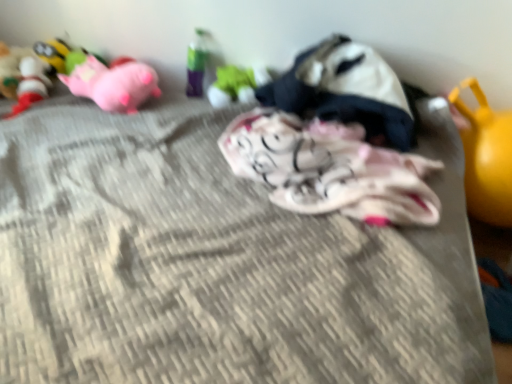
In order to face translucent plastic bottle at upper center, which is the fourth toy from left to right, should I rotate leftwards or rightwards?

Rotate left and turn 7.596 degrees.

The image size is (512, 384). What do you see at coordinates (217, 262) in the screenshot?
I see `textured fabric mattress at center` at bounding box center [217, 262].

Where is `yellow rubber ball at right, marked as the 8th toy in a left-to-right arrangement`? yellow rubber ball at right, marked as the 8th toy in a left-to-right arrangement is located at coordinates (486, 158).

Describe the element at coordinates (236, 85) in the screenshot. The image size is (512, 384). I see `green matte toy at center, positioned as the fourth toy in right-to-left order` at that location.

Describe the element at coordinates (330, 169) in the screenshot. The height and width of the screenshot is (384, 512). I see `fluffy white blanket at center, which is the 6th toy in left-to-right order` at that location.

What are the coordinates of `pink plush pig at upper left, the sixth toy when ordered from right to left` in the screenshot? It's located at (113, 83).

Image resolution: width=512 pixels, height=384 pixels. Describe the element at coordinates (346, 90) in the screenshot. I see `white cotton blanket at center, the second toy from the right` at that location.

Image resolution: width=512 pixels, height=384 pixels. Identify the location of white cotton blanket at center, the second toy from the right. (346, 90).

Where is `translucent plastic bottle at upper center, which is the fourth toy from left to right`? The height and width of the screenshot is (384, 512). translucent plastic bottle at upper center, which is the fourth toy from left to right is located at coordinates (200, 61).

From a real-world perspective, who is located lower, fluffy white blanket at center, which is the 6th toy in left-to-right order, or white cotton blanket at center, the second toy from the right?

fluffy white blanket at center, which is the 6th toy in left-to-right order.

Can you tell me how much fluffy white blanket at center, placed as the third toy when sorted from right to left, and white cotton blanket at center, which is counted as the seventh toy, starting from the left, differ in facing direction?

2.15e-05 degrees separate the facing orientations of fluffy white blanket at center, placed as the third toy when sorted from right to left, and white cotton blanket at center, which is counted as the seventh toy, starting from the left.

Between fluffy white blanket at center, placed as the third toy when sorted from right to left, and white cotton blanket at center, which is counted as the seventh toy, starting from the left, which one has smaller size?

white cotton blanket at center, which is counted as the seventh toy, starting from the left, is smaller.

Find the location of a particular element. toy that is the 1st object located above the fluffy white blanket at center, which is the 6th toy in left-to-right order (from the image's perspective) is located at coordinates (346, 90).

Is the surface of white cotton blanket at center, which is counted as the seventh toy, starting from the left, in direct contact with yellow rubber ball at right, the 1th toy viewed from the right?

white cotton blanket at center, which is counted as the seventh toy, starting from the left, and yellow rubber ball at right, the 1th toy viewed from the right, are not in contact.

Which of these two, white cotton blanket at center, the second toy from the right, or yellow rubber ball at right, the 1th toy viewed from the right, stands shorter?

white cotton blanket at center, the second toy from the right, is shorter.

Could you measure the distance between white cotton blanket at center, which is counted as the seventh toy, starting from the left, and yellow rubber ball at right, the 1th toy viewed from the right?

white cotton blanket at center, which is counted as the seventh toy, starting from the left, is 13.20 inches from yellow rubber ball at right, the 1th toy viewed from the right.

Which object is positioned more to the left, white cotton blanket at center, the second toy from the right, or yellow rubber ball at right, marked as the 8th toy in a left-to-right arrangement?

From the viewer's perspective, white cotton blanket at center, the second toy from the right, appears more on the left side.

Does green matte toy at center, acting as the fifth toy starting from the left, touch white cotton blanket at center, the second toy from the right?

They are not placed beside each other.

Can you confirm if green matte toy at center, positioned as the fourth toy in right-to-left order, is smaller than white cotton blanket at center, which is counted as the seventh toy, starting from the left?

Correct, green matte toy at center, positioned as the fourth toy in right-to-left order, occupies less space than white cotton blanket at center, which is counted as the seventh toy, starting from the left.

Does green matte toy at center, acting as the fifth toy starting from the left, turn towards white cotton blanket at center, which is counted as the seventh toy, starting from the left?

No.

Which of these two, green matte toy at center, positioned as the fourth toy in right-to-left order, or white cotton blanket at center, which is counted as the seventh toy, starting from the left, is thinner?

With smaller width is green matte toy at center, positioned as the fourth toy in right-to-left order.

Can you confirm if yellow rubber ball at right, the 1th toy viewed from the right, is wider than textured fabric mattress at center?

No, yellow rubber ball at right, the 1th toy viewed from the right, is not wider than textured fabric mattress at center.

Between yellow rubber ball at right, marked as the 8th toy in a left-to-right arrangement, and textured fabric mattress at center, which one has more height?

textured fabric mattress at center is taller.

Based on the photo, from a real-world perspective, who is located higher, yellow rubber ball at right, the 1th toy viewed from the right, or textured fabric mattress at center?

In real-world perspective, yellow rubber ball at right, the 1th toy viewed from the right, is above.

Which is more distant, (x=487, y=131) or (x=53, y=61)?

The point (x=53, y=61) is more distant.

Which is correct: yellow rubber ball at right, the 1th toy viewed from the right, is inside plush yellow toy at upper left, which is counted as the second toy, starting from the left, or outside of it?

yellow rubber ball at right, the 1th toy viewed from the right, is not enclosed by plush yellow toy at upper left, which is counted as the second toy, starting from the left.

Is yellow rubber ball at right, marked as the 8th toy in a left-to-right arrangement, directly adjacent to plush yellow toy at upper left, which is counted as the second toy, starting from the left?

No, yellow rubber ball at right, marked as the 8th toy in a left-to-right arrangement, is not in contact with plush yellow toy at upper left, which is counted as the second toy, starting from the left.

From a real-world perspective, which is physically below, yellow rubber ball at right, the 1th toy viewed from the right, or plush yellow toy at upper left, which is counted as the second toy, starting from the left?

yellow rubber ball at right, the 1th toy viewed from the right, from a real-world perspective.

From the image's perspective, is white cotton blanket at center, the second toy from the right, positioned above or below translucent plastic bottle at upper center, which is the fourth toy from left to right?

From the image's perspective, white cotton blanket at center, the second toy from the right, appears below translucent plastic bottle at upper center, which is the fourth toy from left to right.

Which is more to the left, white cotton blanket at center, which is counted as the seventh toy, starting from the left, or translucent plastic bottle at upper center, which ranks as the 5th toy in right-to-left order?

translucent plastic bottle at upper center, which ranks as the 5th toy in right-to-left order.

From a real-world perspective, does white cotton blanket at center, the second toy from the right, sit lower than translucent plastic bottle at upper center, which ranks as the 5th toy in right-to-left order?

Actually, white cotton blanket at center, the second toy from the right, is physically above translucent plastic bottle at upper center, which ranks as the 5th toy in right-to-left order, in the real world.

Consider the image. Is translucent plastic bottle at upper center, which ranks as the 5th toy in right-to-left order, surrounded by white cotton blanket at center, which is counted as the seventh toy, starting from the left?

Definitely not — translucent plastic bottle at upper center, which ranks as the 5th toy in right-to-left order, is not inside white cotton blanket at center, which is counted as the seventh toy, starting from the left.

How many degrees apart are the facing directions of textured fabric mattress at center and white cotton blanket at center, the second toy from the right?

90 degrees separate the facing orientations of textured fabric mattress at center and white cotton blanket at center, the second toy from the right.

Is textured fabric mattress at center completely or partially outside of white cotton blanket at center, the second toy from the right?

textured fabric mattress at center is positioned outside white cotton blanket at center, the second toy from the right.

Which of these two, textured fabric mattress at center or white cotton blanket at center, which is counted as the seventh toy, starting from the left, is smaller?

Smaller between the two is white cotton blanket at center, which is counted as the seventh toy, starting from the left.

Is textured fabric mattress at center beside white cotton blanket at center, the second toy from the right?

No, textured fabric mattress at center is not with white cotton blanket at center, the second toy from the right.

From the image's perspective, starting from the fluffy white blanket at center, placed as the third toy when sorted from right to left, which toy is the 1st one above? Please provide its 2D coordinates.

[(346, 90)]

Locate an element on the screen. The image size is (512, 384). the 2nd toy below when counting from the white cotton blanket at center, the second toy from the right (from the image's perspective) is located at coordinates (486, 158).

Based on their spatial positions, is matte pink plush at upper left, which ranks as the 1th toy in left-to-right order, or fluffy white blanket at center, which is the 6th toy in left-to-right order, closer to green matte toy at center, positioned as the fourth toy in right-to-left order?

Among the two, fluffy white blanket at center, which is the 6th toy in left-to-right order, is located nearer to green matte toy at center, positioned as the fourth toy in right-to-left order.

Considering their positions, is green matte toy at center, positioned as the fourth toy in right-to-left order, positioned further to translucent plastic bottle at upper center, which is the fourth toy from left to right, than white cotton blanket at center, which is counted as the seventh toy, starting from the left?

Among the two, white cotton blanket at center, which is counted as the seventh toy, starting from the left, is located further to translucent plastic bottle at upper center, which is the fourth toy from left to right.

Which object lies nearer to the anchor point yellow rubber ball at right, the 1th toy viewed from the right, pink plush pig at upper left, the sixth toy when ordered from right to left, or green matte toy at center, acting as the fifth toy starting from the left?

green matte toy at center, acting as the fifth toy starting from the left, is closer to yellow rubber ball at right, the 1th toy viewed from the right.

Considering their positions, is fluffy white blanket at center, which is the 6th toy in left-to-right order, positioned closer to plush yellow toy at upper left, which appears as the 7th toy when viewed from the right, than yellow rubber ball at right, the 1th toy viewed from the right?

fluffy white blanket at center, which is the 6th toy in left-to-right order, is closer to plush yellow toy at upper left, which appears as the 7th toy when viewed from the right.

Which object lies nearer to the anchor point white cotton blanket at center, which is counted as the seventh toy, starting from the left, textured fabric mattress at center or matte pink plush at upper left, which ranks as the 1th toy in left-to-right order?

Among the two, textured fabric mattress at center is located nearer to white cotton blanket at center, which is counted as the seventh toy, starting from the left.

When comparing their distances from yellow rubber ball at right, the 1th toy viewed from the right, does pink plush pig at upper left, the sixth toy when ordered from right to left, or matte pink plush at upper left, which ranks as the 1th toy in left-to-right order, seem closer?

pink plush pig at upper left, the sixth toy when ordered from right to left, lies closer to yellow rubber ball at right, the 1th toy viewed from the right, than the other object.

Based on their spatial positions, is green matte toy at center, acting as the fifth toy starting from the left, or matte pink plush at upper left, which ranks as the 1th toy in left-to-right order, further from white cotton blanket at center, which is counted as the seventh toy, starting from the left?

Among the two, matte pink plush at upper left, which ranks as the 1th toy in left-to-right order, is located further to white cotton blanket at center, which is counted as the seventh toy, starting from the left.

Which object lies nearer to the anchor point fluffy white blanket at center, which is the 6th toy in left-to-right order, textured fabric mattress at center or translucent plastic bottle at upper center, which is the fourth toy from left to right?

textured fabric mattress at center.

Find the location of a particular element. The width and height of the screenshot is (512, 384). mattress situated between matte pink plush at upper left, which ranks as the 1th toy in left-to-right order, and white cotton blanket at center, the second toy from the right, from left to right is located at coordinates (217, 262).

At what (x,y) coordinates should I click in order to perform the action: click on mattress located between pink plush pig at upper left, the sixth toy when ordered from right to left, and yellow rubber ball at right, marked as the 8th toy in a left-to-right arrangement, in the left-right direction. Please return your answer as a coordinate pair (x, y). The width and height of the screenshot is (512, 384). Looking at the image, I should click on (217, 262).

Find the location of a particular element. This screenshot has width=512, height=384. mattress between matte pink plush at upper left, which appears as the 8th toy when viewed from the right, and yellow rubber ball at right, the 1th toy viewed from the right is located at coordinates (217, 262).

Identify the location of toy between fluffy white blanket at center, placed as the third toy when sorted from right to left, and yellow rubber ball at right, the 1th toy viewed from the right, from left to right. (346, 90).